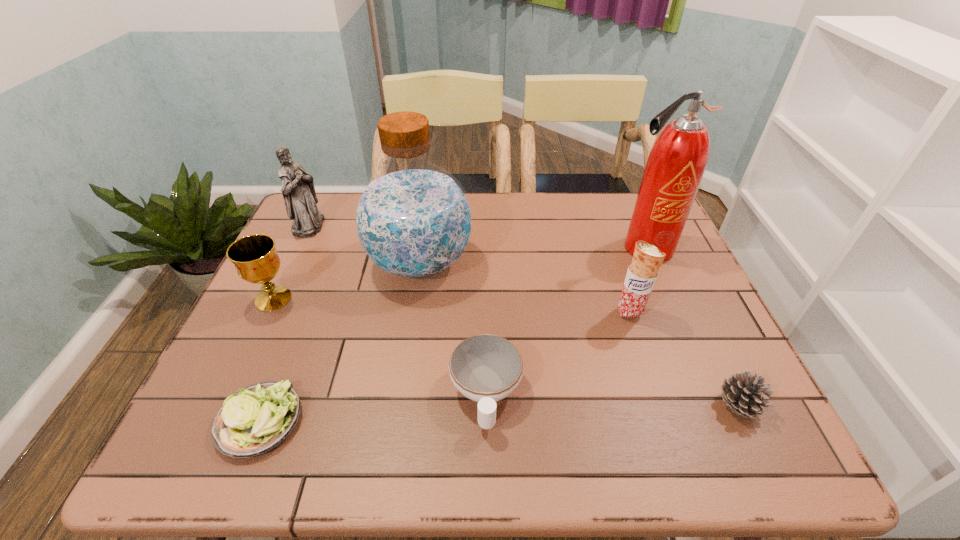
Where is `fire extinguisher`? The height and width of the screenshot is (540, 960). fire extinguisher is located at coordinates (676, 164).

Locate an element on the screen. water jug is located at coordinates (413, 220).

Identify the location of the third tallest object. (x=298, y=190).

Locate an element on the screen. Image resolution: width=960 pixels, height=540 pixels. the fifth shortest object is located at coordinates (641, 275).

The width and height of the screenshot is (960, 540). What are the coordinates of `the fourth shortest object` in the screenshot? It's located at (256, 261).

Find the location of a particular element. The height and width of the screenshot is (540, 960). pinecone is located at coordinates (743, 392).

I want to click on chinaware, so click(485, 368).

Find the location of `the shortest object`. the shortest object is located at coordinates (258, 418).

Where is `vacant space located 0.210m on the front of the fire extinguisher`? Image resolution: width=960 pixels, height=540 pixels. vacant space located 0.210m on the front of the fire extinguisher is located at coordinates (676, 320).

Locate an element on the screen. Image resolution: width=960 pixels, height=540 pixels. vacant position located 0.090m on the back of the water jug is located at coordinates (427, 213).